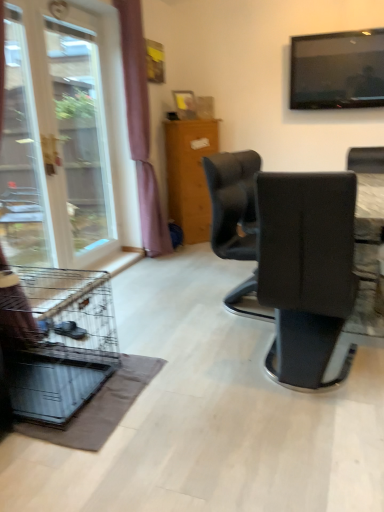
Question: Considering the relative sizes of flat screen tv at upper right and transparent glass screen door at left in the image provided, is flat screen tv at upper right thinner than transparent glass screen door at left?

Choices:
 (A) no
 (B) yes

Answer: (A)

Question: Is the position of flat screen tv at upper right less distant than that of transparent glass screen door at left?

Choices:
 (A) no
 (B) yes

Answer: (A)

Question: From a real-world perspective, is flat screen tv at upper right located higher than transparent glass screen door at left?

Choices:
 (A) no
 (B) yes

Answer: (B)

Question: From a real-world perspective, is flat screen tv at upper right located beneath transparent glass screen door at left?

Choices:
 (A) yes
 (B) no

Answer: (B)

Question: Can you confirm if flat screen tv at upper right is smaller than transparent glass screen door at left?

Choices:
 (A) yes
 (B) no

Answer: (B)

Question: From the image's perspective, is flat screen tv at upper right on top of transparent glass screen door at left?

Choices:
 (A) no
 (B) yes

Answer: (B)

Question: Can transparent glass window at left be found inside wooden cabinet at center?

Choices:
 (A) no
 (B) yes

Answer: (A)

Question: Is wooden cabinet at center not near transparent glass window at left?

Choices:
 (A) no
 (B) yes

Answer: (B)

Question: Does wooden cabinet at center appear on the left side of transparent glass window at left?

Choices:
 (A) yes
 (B) no

Answer: (B)

Question: Considering the relative sizes of wooden cabinet at center and transparent glass window at left in the image provided, is wooden cabinet at center smaller than transparent glass window at left?

Choices:
 (A) no
 (B) yes

Answer: (A)

Question: Is wooden cabinet at center facing away from transparent glass window at left?

Choices:
 (A) yes
 (B) no

Answer: (B)

Question: Is wooden cabinet at center beside transparent glass window at left?

Choices:
 (A) yes
 (B) no

Answer: (B)

Question: Is black leather chair at center closer to the viewer compared to transparent glass window at left?

Choices:
 (A) yes
 (B) no

Answer: (A)